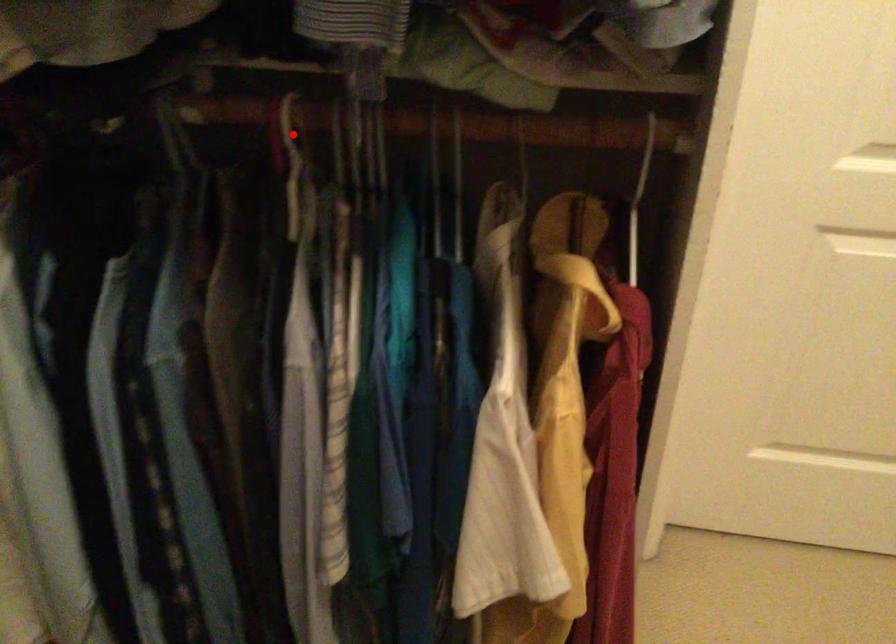
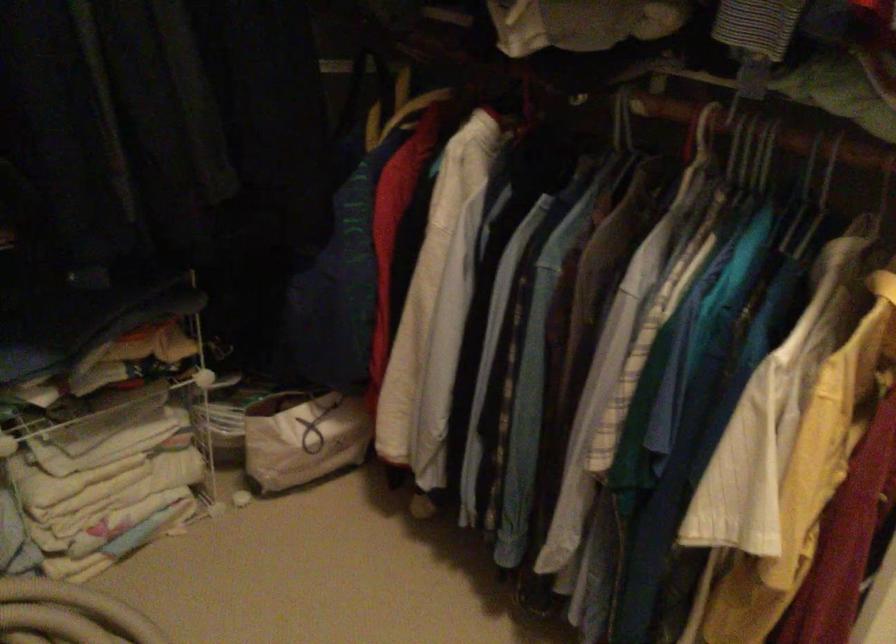
Question: I am providing you with two images of the same scene from different viewpoints. Given a red point in image1, look at the same physical point in image2. Is it:

Choices:
 (A) Closer to the viewpoint
 (B) Farther from the viewpoint

Answer: (B)